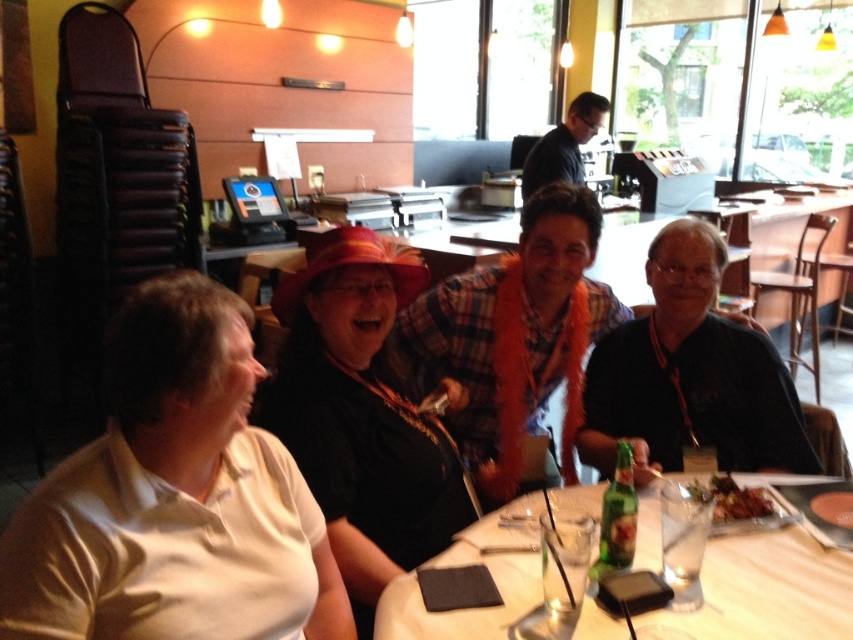
What do you see at coordinates (689, 376) in the screenshot? This screenshot has height=640, width=853. I see `black fabric shirt at right` at bounding box center [689, 376].

Who is more distant from viewer, (795, 442) or (758, 500)?

The point (795, 442) is behind.

Is point (666, 387) positioned in front of point (697, 477)?

No, it is not.

Find the location of a particular element. black fabric shirt at right is located at coordinates (689, 376).

Is white matte shirt at left behind clear glass table at center?

No, white matte shirt at left is closer to the viewer.

Describe the element at coordinates (173, 497) in the screenshot. The image size is (853, 640). I see `white matte shirt at left` at that location.

Where is `white matte shirt at left`? Image resolution: width=853 pixels, height=640 pixels. white matte shirt at left is located at coordinates (173, 497).

Does matte black shirt at center have a lesser width compared to shiny brown plate at table center?

Incorrect, matte black shirt at center's width is not less than shiny brown plate at table center's.

Is matte black shirt at center bigger than shiny brown plate at table center?

Correct, matte black shirt at center is larger in size than shiny brown plate at table center.

Between point (310, 404) and point (714, 484), which one is positioned behind?

Point (714, 484)

Where is `matte black shirt at center`? Image resolution: width=853 pixels, height=640 pixels. matte black shirt at center is located at coordinates (361, 413).